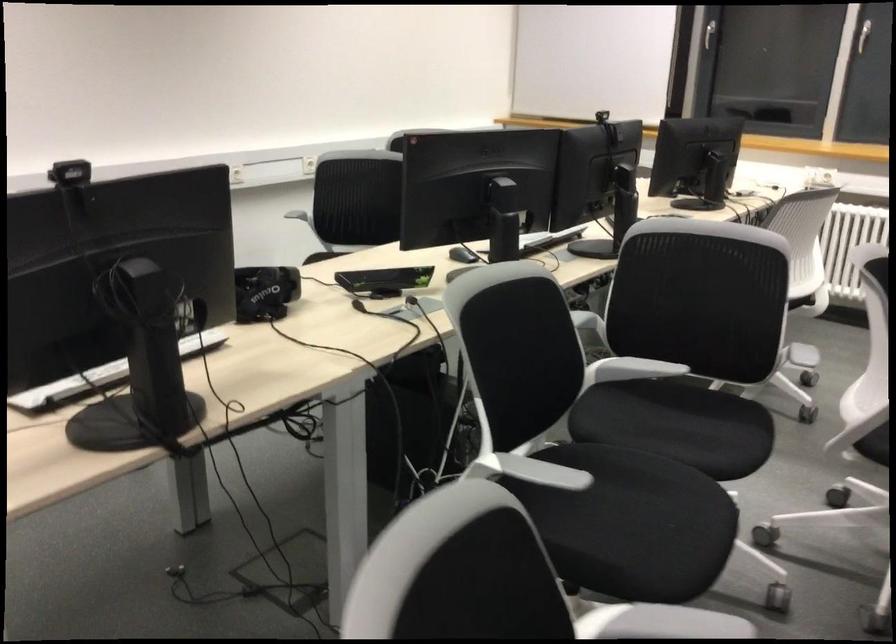
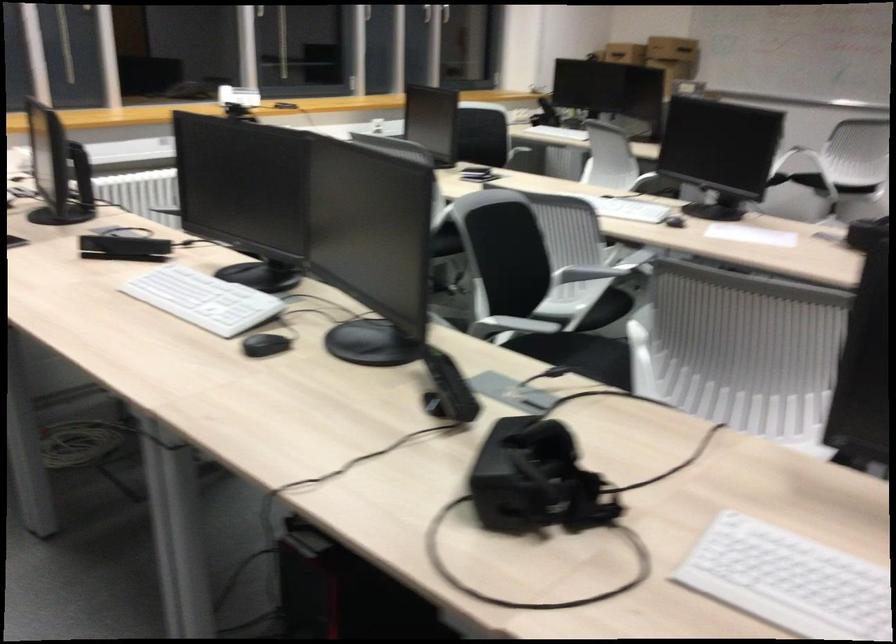
In the second image, find the point that corresponds to point 787,346 in the first image.

(586, 272)